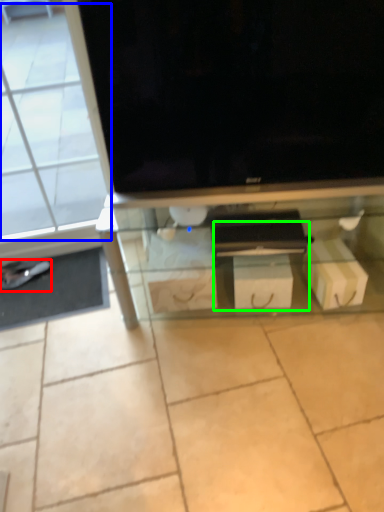
Question: Which is farther away from footwear (highlighted by a red box)? glass door (highlighted by a blue box) or drawer (highlighted by a green box)?

Choices:
 (A) glass door
 (B) drawer

Answer: (B)